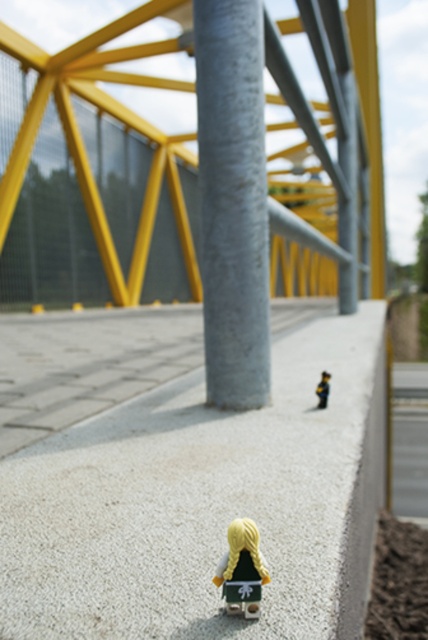
Between yellow metallic bridge at upper center and gray metallic pole at center, which one is positioned lower?

gray metallic pole at center

Between point (299, 17) and point (258, 349), which one is positioned behind?

The point (299, 17) is more distant.

Where is `yellow metallic bridge at upper center`? yellow metallic bridge at upper center is located at coordinates (113, 116).

Who is positioned more to the left, gray metallic pole at center or matte yellow hair at lower center?

From the viewer's perspective, matte yellow hair at lower center appears more on the left side.

Is point (238, 209) behind point (241, 605)?

Yes, it is behind point (241, 605).

Does point (255, 49) come in front of point (238, 579)?

No, it is not.

I want to click on gray metallic pole at center, so click(x=232, y=202).

Find the location of a particular element. Image resolution: width=428 pixels, height=640 pixels. gray concrete curb at right is located at coordinates (365, 493).

Find the location of `gray concrete curb at right`. gray concrete curb at right is located at coordinates pos(365,493).

Identify the location of gray concrete curb at right. (365, 493).